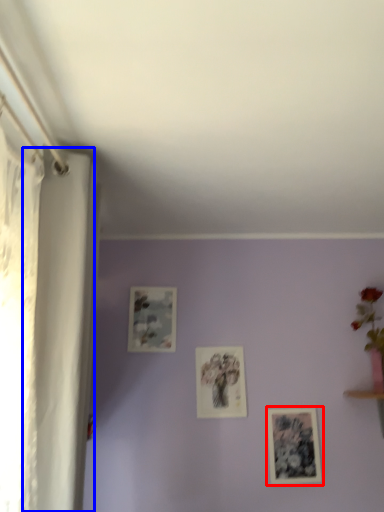
Question: Which object appears closest to the camera in this image, picture frame (highlighted by a red box) or curtain (highlighted by a blue box)?

Choices:
 (A) picture frame
 (B) curtain

Answer: (B)